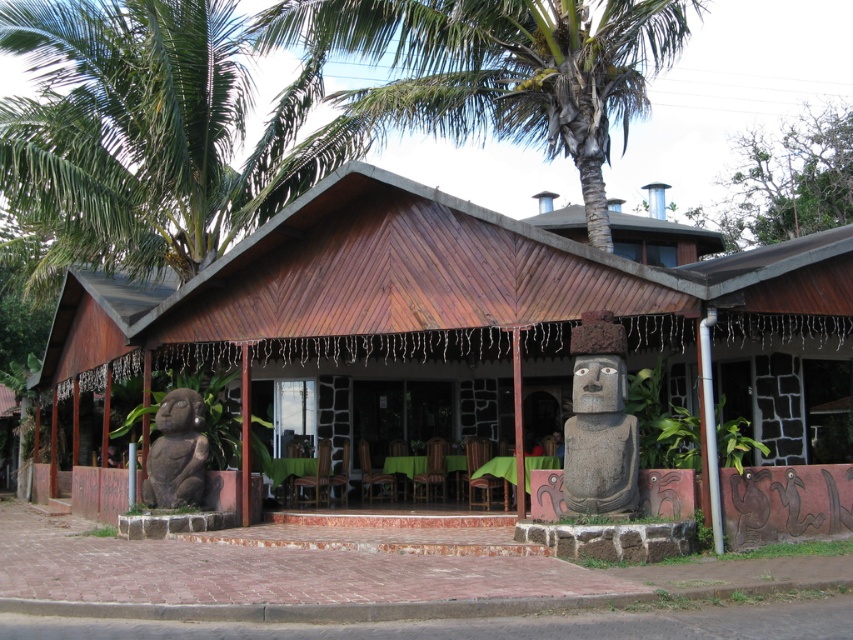
Is green leafy palm tree at upper left to the right of polished stone statue at center from the viewer's perspective?

In fact, green leafy palm tree at upper left is to the left of polished stone statue at center.

Who is positioned more to the right, green leafy palm tree at upper left or polished stone statue at center?

polished stone statue at center

I want to click on green leafy palm tree at upper left, so pos(146,134).

Is wooden hut at center bigger than brown stone statue at left?

Yes.

What do you see at coordinates (450, 316) in the screenshot?
I see `wooden hut at center` at bounding box center [450, 316].

The width and height of the screenshot is (853, 640). Find the location of `wooden hut at center`. wooden hut at center is located at coordinates (450, 316).

What do you see at coordinates (498, 68) in the screenshot?
I see `green leafy palm tree at upper center` at bounding box center [498, 68].

This screenshot has height=640, width=853. In order to click on green leafy palm tree at upper center in this screenshot , I will do `click(498, 68)`.